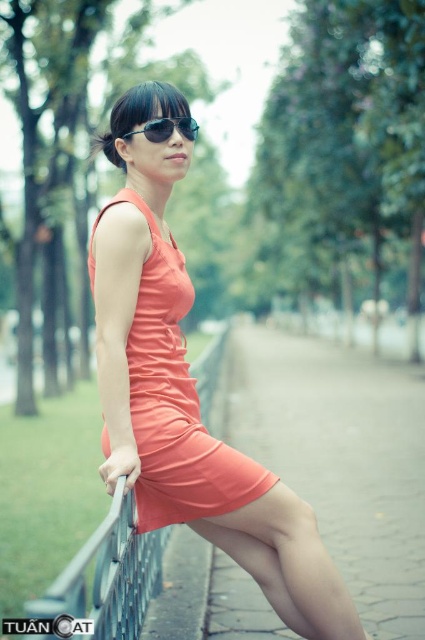
You are a photographer setting up a tripod 5 feet away from the person in the scene. You notice the metallic gray fence at lower left and the black reflective sunglasses at center. Can you fit both objects in your shot without moving the tripod?

The metallic gray fence at lower left is 6.53 feet away from the black reflective sunglasses at center. Since the tripod is set 5 feet away from the person, the distance between the two objects exceeds the tripod position, making it difficult to capture both in a single frame without adjusting the camera angle or moving the tripod.

You are a fashion designer observing two dresses in the image. The person is wearing both the matte orange dress at center and the coral satin dress at center. Which dress is longer in length?

The matte orange dress at center is much taller than the coral satin dress at center, so the matte orange dress at center is longer in length.

You are a fashion designer observing two dresses in a photo. The first is a matte orange dress at center, and the second is a coral satin dress at center. Which dress has a larger size?

The matte orange dress at center is bigger than the coral satin dress at center.